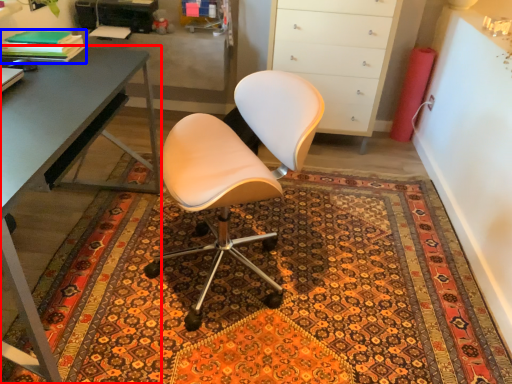
Question: Which object is further to the camera taking this photo, desk (highlighted by a red box) or book (highlighted by a blue box)?

Choices:
 (A) desk
 (B) book

Answer: (B)